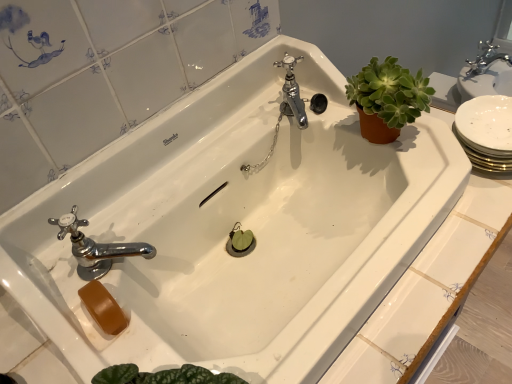
The height and width of the screenshot is (384, 512). Identify the location of green succulent at upper right. (387, 98).

What is the approximate height of green succulent at upper right?

5.58 inches.

At what (x,y) coordinates should I click in order to perform the action: click on chrome metallic faucet at center, the 2th tap positioned from the bottom. Please return your answer as a coordinate pair (x, y). This screenshot has height=384, width=512. Looking at the image, I should click on (292, 92).

Image resolution: width=512 pixels, height=384 pixels. Find the location of `green succulent at upper right`. green succulent at upper right is located at coordinates pyautogui.click(x=387, y=98).

Does chrome metallic faucet at center, the second tap viewed from the front, appear on the right side of chrome metallic faucet at lower left, marked as the second tap in a back-to-front arrangement?

Yes, chrome metallic faucet at center, the second tap viewed from the front, is to the right of chrome metallic faucet at lower left, marked as the second tap in a back-to-front arrangement.

Does chrome metallic faucet at center, the 1th tap positioned from the right, have a lesser height compared to chrome metallic faucet at lower left, arranged as the second tap when viewed from the top?

Incorrect, the height of chrome metallic faucet at center, the 1th tap positioned from the right, does not fall short of that of chrome metallic faucet at lower left, arranged as the second tap when viewed from the top.

Considering the positions of objects chrome metallic faucet at center, the first tap viewed from the back, and chrome metallic faucet at lower left, marked as the second tap in a back-to-front arrangement, in the image provided, who is in front, chrome metallic faucet at center, the first tap viewed from the back, or chrome metallic faucet at lower left, marked as the second tap in a back-to-front arrangement,?

chrome metallic faucet at lower left, marked as the second tap in a back-to-front arrangement.

Between point (286, 91) and point (80, 263), which one is positioned behind?

Point (286, 91)

From the image's perspective, which is below, chrome metallic faucet at lower left, marked as the second tap in a back-to-front arrangement, or chrome metallic faucet at center, the 2th tap positioned from the bottom?

chrome metallic faucet at lower left, marked as the second tap in a back-to-front arrangement, appears lower in the image.

Who is shorter, chrome metallic faucet at lower left, placed as the 1th tap when sorted from front to back, or chrome metallic faucet at center, the second tap viewed from the left?

Standing shorter between the two is chrome metallic faucet at lower left, placed as the 1th tap when sorted from front to back.

Between chrome metallic faucet at lower left, arranged as the second tap when viewed from the top, and chrome metallic faucet at center, the second tap viewed from the front, which one has larger size?

With larger size is chrome metallic faucet at lower left, arranged as the second tap when viewed from the top.

Who is smaller, chrome metallic faucet at lower left, marked as the second tap in a back-to-front arrangement, or green succulent at upper right?

chrome metallic faucet at lower left, marked as the second tap in a back-to-front arrangement.

Between chrome metallic faucet at lower left, which is the second tap from right to left, and green succulent at upper right, which one appears on the right side from the viewer's perspective?

Positioned to the right is green succulent at upper right.

Which point is more distant from viewer, (79,236) or (384,78)?

The point (384,78) is farther from the camera.

Could you tell me if chrome metallic faucet at center, the 1th tap positioned from the top, is turned towards green succulent at upper right?

No, chrome metallic faucet at center, the 1th tap positioned from the top, is not oriented towards green succulent at upper right.

From the image's perspective, does chrome metallic faucet at center, the first tap viewed from the back, appear lower than green succulent at upper right?

No, from the image's perspective, chrome metallic faucet at center, the first tap viewed from the back, is not below green succulent at upper right.

Looking at this image, considering the relative sizes of chrome metallic faucet at center, the first tap viewed from the back, and green succulent at upper right in the image provided, is chrome metallic faucet at center, the first tap viewed from the back, smaller than green succulent at upper right?

Indeed, chrome metallic faucet at center, the first tap viewed from the back, has a smaller size compared to green succulent at upper right.

Is green succulent at upper right not inside chrome metallic faucet at lower left, placed as the 1th tap when sorted from front to back?

Yes.

From the image's perspective, who appears lower, green succulent at upper right or chrome metallic faucet at lower left, placed as the 1th tap when sorted from front to back?

chrome metallic faucet at lower left, placed as the 1th tap when sorted from front to back, appears lower in the image.

Is chrome metallic faucet at lower left, arranged as the second tap when viewed from the top, at the back of green succulent at upper right?

No, chrome metallic faucet at lower left, arranged as the second tap when viewed from the top, is not at the back of green succulent at upper right.

Is green succulent at upper right wider than chrome metallic faucet at center, the second tap viewed from the front?

Yes.

Is green succulent at upper right oriented away from chrome metallic faucet at center, the first tap viewed from the back?

That's right, green succulent at upper right is facing away from chrome metallic faucet at center, the first tap viewed from the back.

Which object is closer to the camera, green succulent at upper right or chrome metallic faucet at center, the second tap viewed from the left?

green succulent at upper right is more forward.

You are a GUI agent. You are given a task and a screenshot of the screen. Output one action in this format:
    pyautogui.click(x=<x>, y=<y>)
    Task: Click on the houseplant in front of the chrome metallic faucet at center, the second tap viewed from the front
    This screenshot has height=384, width=512.
    Given the screenshot: What is the action you would take?
    pyautogui.click(x=387, y=98)

Identify the location of tap lying above the chrome metallic faucet at lower left, which is the first tap in left-to-right order (from the image's perspective). (292, 92).

Find the location of a particular element. The width and height of the screenshot is (512, 384). tap in front of the chrome metallic faucet at center, the 2th tap positioned from the bottom is located at coordinates (96, 247).

Looking at the image, which one is located further to chrome metallic faucet at center, the second tap viewed from the left, green succulent at upper right or chrome metallic faucet at lower left, placed as the 1th tap when sorted from front to back?

chrome metallic faucet at lower left, placed as the 1th tap when sorted from front to back.

Based on their spatial positions, is green succulent at upper right or chrome metallic faucet at center, the second tap viewed from the front, closer to chrome metallic faucet at lower left, marked as the second tap in a back-to-front arrangement?

Among the two, chrome metallic faucet at center, the second tap viewed from the front, is located nearer to chrome metallic faucet at lower left, marked as the second tap in a back-to-front arrangement.

When comparing their distances from green succulent at upper right, does chrome metallic faucet at center, the 1th tap positioned from the right, or chrome metallic faucet at lower left, which is the second tap from right to left, seem further?

chrome metallic faucet at lower left, which is the second tap from right to left, is positioned further to the anchor green succulent at upper right.

Which object lies further to the anchor point chrome metallic faucet at center, the second tap viewed from the front, chrome metallic faucet at lower left, which is the first tap in left-to-right order, or green succulent at upper right?

The object further to chrome metallic faucet at center, the second tap viewed from the front, is chrome metallic faucet at lower left, which is the first tap in left-to-right order.

Looking at the image, which one is located further to chrome metallic faucet at lower left, which is the first tap in left-to-right order, chrome metallic faucet at center, the second tap viewed from the front, or green succulent at upper right?

green succulent at upper right is positioned further to the anchor chrome metallic faucet at lower left, which is the first tap in left-to-right order.

Looking at the image, which one is located further to green succulent at upper right, chrome metallic faucet at lower left, placed as the 1th tap when sorted from front to back, or chrome metallic faucet at center, the second tap viewed from the left?

Based on the image, chrome metallic faucet at lower left, placed as the 1th tap when sorted from front to back, appears to be further to green succulent at upper right.

The width and height of the screenshot is (512, 384). I want to click on tap between chrome metallic faucet at lower left, marked as the second tap in a back-to-front arrangement, and green succulent at upper right, in the horizontal direction, so click(292, 92).